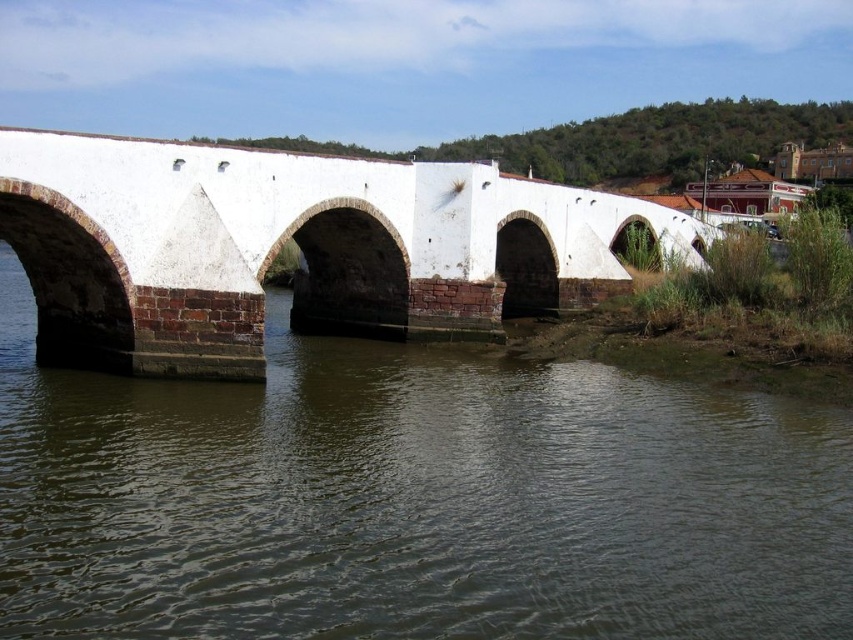
Who is shorter, brown stone river at center or white brick bridge at center?

With less height is brown stone river at center.

Is point (73, 397) in front of point (149, 365)?

That is True.

Is point (91, 378) positioned in front of point (120, 211)?

No.

Where is `brown stone river at center`? brown stone river at center is located at coordinates (412, 499).